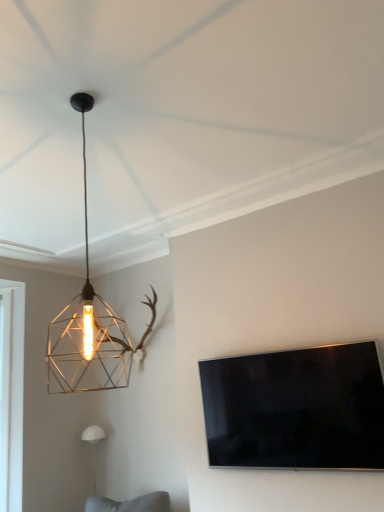
Question: Is metallic wire cage at upper left, which is the first lamp from front to back, inside or outside of white matte wall sconce at lower left, the second lamp viewed from the front?

Choices:
 (A) inside
 (B) outside

Answer: (B)

Question: Considering their positions, is metallic wire cage at upper left, arranged as the 2th lamp when ordered from the bottom, located in front of or behind white matte wall sconce at lower left, the first lamp in the back-to-front sequence?

Choices:
 (A) front
 (B) behind

Answer: (A)

Question: Estimate the real-world distances between objects in this image. Which object is farther from the white matte wall sconce at lower left, the second lamp viewed from the front?

Choices:
 (A) metallic wire cage at upper left, arranged as the 2th lamp when ordered from the bottom
 (B) flat-screen tv at right

Answer: (B)

Question: Which object is the farthest from the flat-screen tv at right?

Choices:
 (A) metallic wire cage at upper left, arranged as the 2th lamp when ordered from the bottom
 (B) white matte wall sconce at lower left, which appears as the 1th lamp when viewed from the left

Answer: (B)